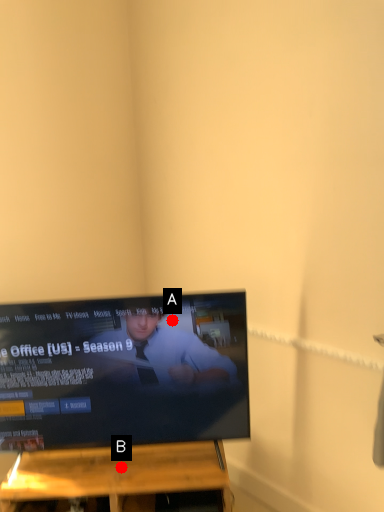
Question: Two points are circled on the image, labeled by A and B beside each circle. Among these points, which one is farthest from the camera?

Choices:
 (A) A is further
 (B) B is further

Answer: (B)